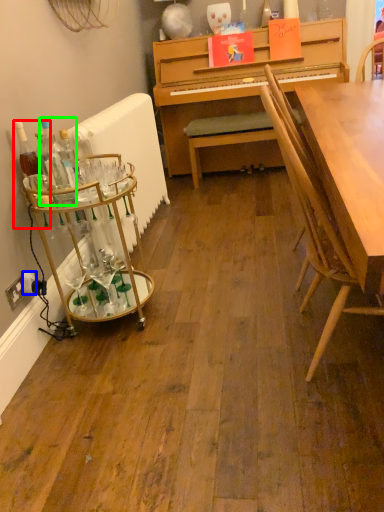
Question: Estimate the real-world distances between objects in this image. Which object is closer to bottle (highlighted by a red box), power outlet (highlighted by a blue box) or bottle (highlighted by a green box)?

Choices:
 (A) power outlet
 (B) bottle

Answer: (B)